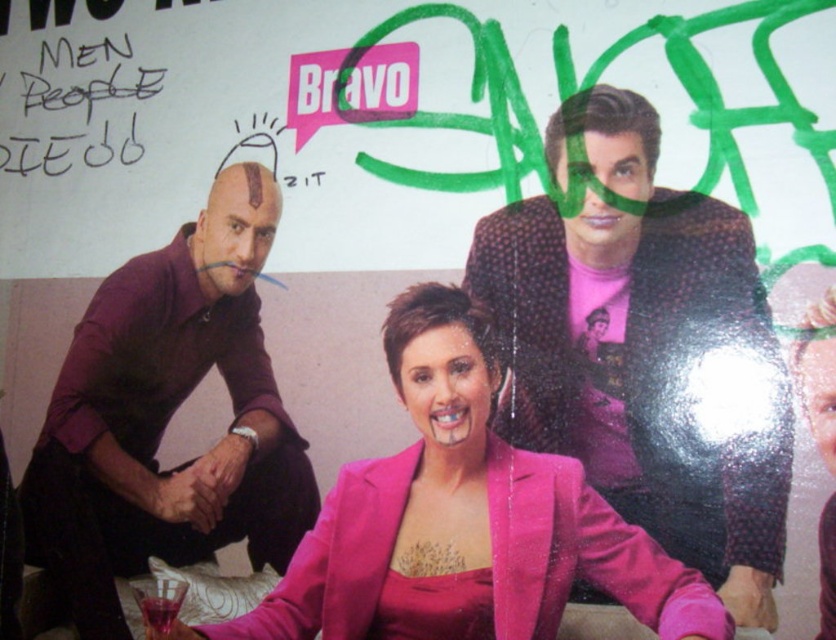
Question: Which object is farther from the camera taking this photo?

Choices:
 (A) purple matte shirt at left
 (B) black handwritten text at upper left
 (C) pink satin blazer at center

Answer: (B)

Question: Does pink satin blazer at center lie behind black handwritten text at upper left?

Choices:
 (A) no
 (B) yes

Answer: (A)

Question: Can you confirm if pink satin blazer at center is wider than purple matte shirt at left?

Choices:
 (A) yes
 (B) no

Answer: (A)

Question: Does pink satin blazer at center appear on the left side of black handwritten text at upper left?

Choices:
 (A) no
 (B) yes

Answer: (A)

Question: Which of these objects is positioned farthest from the pink satin blazer at center?

Choices:
 (A) black handwritten text at upper left
 (B) purple matte shirt at left

Answer: (A)

Question: Among these points, which one is nearest to the camera?

Choices:
 (A) (x=311, y=481)
 (B) (x=3, y=131)
 (C) (x=584, y=513)

Answer: (C)